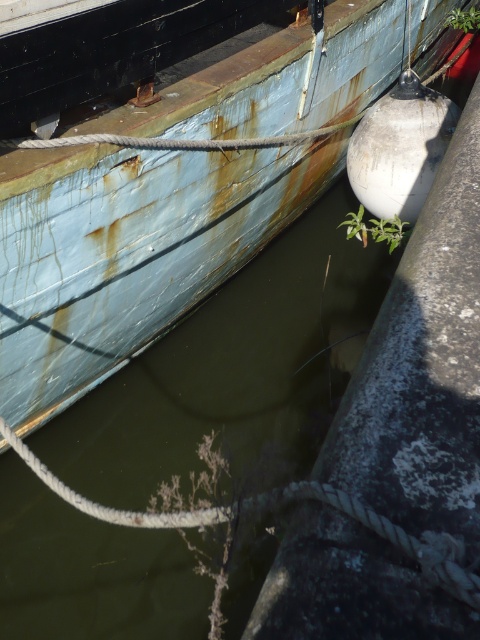
Does rusty metal boat at upper left have a greater width compared to green leafy plant at lower right?

Correct, the width of rusty metal boat at upper left exceeds that of green leafy plant at lower right.

Between rusty metal boat at upper left and green leafy plant at lower right, which one is positioned higher?

rusty metal boat at upper left is higher up.

Image resolution: width=480 pixels, height=640 pixels. Identify the location of rusty metal boat at upper left. (128, 252).

Looking at this image, who is shorter, green murky water at center or rusty metal boat at upper left?

green murky water at center is shorter.

Is green murky water at center to the left of rusty metal boat at upper left from the viewer's perspective?

Incorrect, green murky water at center is not on the left side of rusty metal boat at upper left.

What do you see at coordinates (229, 378) in the screenshot? I see `green murky water at center` at bounding box center [229, 378].

Find the location of `green murky water at center`. green murky water at center is located at coordinates (229, 378).

Can you confirm if rusty metal boat at upper left is positioned above green leafy plant at upper right?

Actually, rusty metal boat at upper left is below green leafy plant at upper right.

Is point (66, 330) positioned in front of point (467, 32)?

Yes, it is.

What are the coordinates of `rusty metal boat at upper left` in the screenshot? It's located at (128, 252).